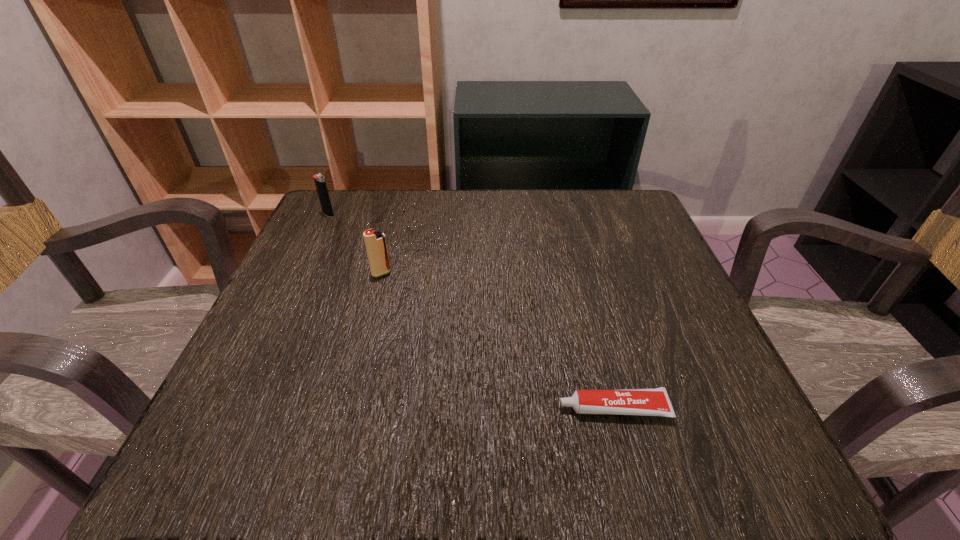
Where is `vacant space at the right edge of the desktop`? vacant space at the right edge of the desktop is located at coordinates (708, 352).

Find the location of `free spot at the far left corner of the desktop`. free spot at the far left corner of the desktop is located at coordinates [365, 189].

In order to click on vacant position at the near left corner of the desktop in this screenshot , I will do `click(186, 474)`.

I want to click on free space at the far right corner of the desktop, so click(x=632, y=204).

The height and width of the screenshot is (540, 960). In order to click on free area in between the left igniter and the second object from right to left in this screenshot , I will do `click(355, 244)`.

I want to click on vacant region between the toothpaste and the leftmost object, so click(470, 312).

The image size is (960, 540). I want to click on free spot between the farthest object and the nearest object, so click(x=470, y=312).

Find the location of a particular element. This screenshot has width=960, height=540. empty location between the nearest object and the farther igniter is located at coordinates (470, 312).

The width and height of the screenshot is (960, 540). Identify the location of free space between the farther igniter and the second farthest object. (355, 244).

Image resolution: width=960 pixels, height=540 pixels. I want to click on blank region between the leftmost object and the rightmost object, so click(470, 312).